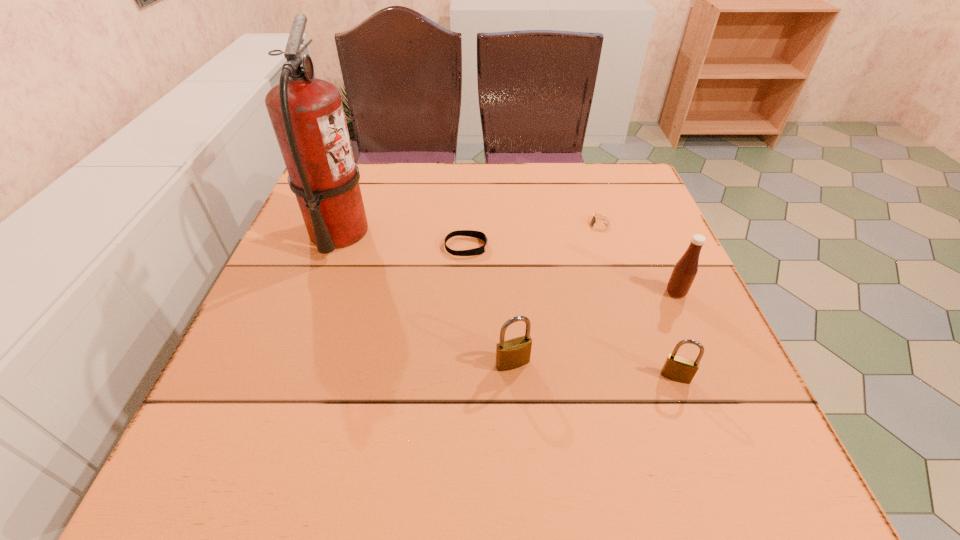
At what (x,y) coordinates should I click in order to perform the action: click on free space located 0.260m on the back of the left padlock. Please return your answer as a coordinate pair (x, y). Looking at the image, I should click on (506, 260).

This screenshot has height=540, width=960. What are the coordinates of `blank space located 0.200m on the left of the shorter padlock` in the screenshot? It's located at (546, 377).

The width and height of the screenshot is (960, 540). I want to click on free spot located 0.210m on the front of the Tabasco sauce, so (719, 391).

Identify the location of vacant position located on the face of the watch. The width and height of the screenshot is (960, 540). [x=472, y=225].

You are a GUI agent. You are given a task and a screenshot of the screen. Output one action in this format:
    pyautogui.click(x=<x>, y=<y>)
    Task: Click on the vacant space situated on the face of the watch
    The height and width of the screenshot is (540, 960).
    Given the screenshot: What is the action you would take?
    pyautogui.click(x=460, y=225)

Locate an element on the screen. The height and width of the screenshot is (540, 960). vacant region located on the face of the watch is located at coordinates (431, 225).

Image resolution: width=960 pixels, height=540 pixels. Find the location of `vacant space located 0.220m toward the nozzle of the fire extinguisher`. vacant space located 0.220m toward the nozzle of the fire extinguisher is located at coordinates (462, 233).

Where is `vacant space located 0.370m on the display of the second object from left to right`? This screenshot has width=960, height=540. vacant space located 0.370m on the display of the second object from left to right is located at coordinates coord(649,247).

The height and width of the screenshot is (540, 960). What are the coordinates of `object that is at the far edge` in the screenshot? It's located at (307, 115).

Where is `object that is at the near edge`? This screenshot has height=540, width=960. object that is at the near edge is located at coordinates (677, 368).